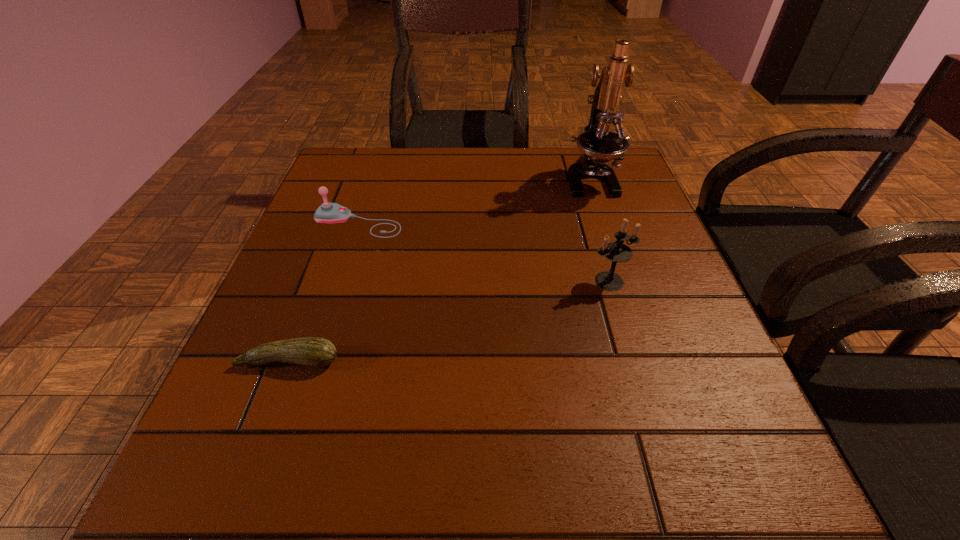
Where is `free location at the left edge`? The image size is (960, 540). free location at the left edge is located at coordinates (281, 304).

Identify the location of vacant space at the right edge of the desktop. pos(627,206).

Identify the location of free space at the far left corner. (355, 188).

This screenshot has height=540, width=960. What are the coordinates of `vacant region at the near right corner of the desktop` in the screenshot? It's located at (699, 472).

Image resolution: width=960 pixels, height=540 pixels. I want to click on empty location between the second nearest object and the microscope, so click(x=600, y=231).

At what (x,y) coordinates should I click in order to perform the action: click on vacant space in between the tallest object and the second farthest object. Please return your answer as a coordinate pair (x, y). The height and width of the screenshot is (540, 960). Looking at the image, I should click on (474, 201).

Where is `free space between the shortest object and the joystick`? This screenshot has width=960, height=540. free space between the shortest object and the joystick is located at coordinates [x=324, y=292].

I want to click on free space between the shortest object and the joystick, so click(x=324, y=292).

This screenshot has width=960, height=540. Identify the location of vacant area that lies between the third farthest object and the zucchini. point(449,321).

The width and height of the screenshot is (960, 540). What are the coordinates of `vacant space in between the farthest object and the third tallest object` in the screenshot? It's located at (474, 201).